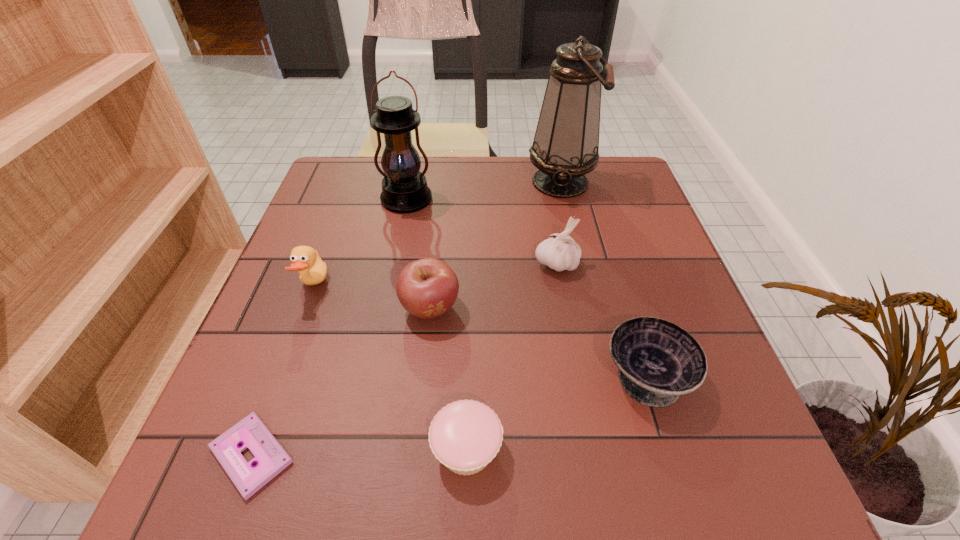
Where is `empty space that is in between the bowl and the oil lamp`? The image size is (960, 540). empty space that is in between the bowl and the oil lamp is located at coordinates (604, 279).

Locate an element on the screen. free space between the cupcake and the videotape is located at coordinates (359, 452).

What are the coordinates of `object that is the third closest one to the videotape` in the screenshot? It's located at (306, 260).

Locate an element on the screen. The image size is (960, 540). object that is the seventh closest to the bowl is located at coordinates pyautogui.click(x=306, y=260).

Identify the location of vacant region that satisfies the following two spatial constraints: 1. on the beak of the duck; 2. on the left side of the cupcake. The height and width of the screenshot is (540, 960). coord(253,449).

Where is `free space that satisfies the following two spatial constraints: 1. on the beak of the videotape; 2. on the left side of the duck`? Image resolution: width=960 pixels, height=540 pixels. free space that satisfies the following two spatial constraints: 1. on the beak of the videotape; 2. on the left side of the duck is located at coordinates (252, 455).

The width and height of the screenshot is (960, 540). Find the location of `free region that satisfies the following two spatial constraints: 1. above the lantern, indicating its light source; 2. on the right side of the bowl`. free region that satisfies the following two spatial constraints: 1. above the lantern, indicating its light source; 2. on the right side of the bowl is located at coordinates (371, 376).

Where is `blank area in the image that satisfies the following two spatial constraints: 1. on the back side of the cupcake; 2. on the right side of the oil lamp`? This screenshot has height=540, width=960. blank area in the image that satisfies the following two spatial constraints: 1. on the back side of the cupcake; 2. on the right side of the oil lamp is located at coordinates (472, 182).

Find the location of `vacant space that satisfies the following two spatial constraints: 1. on the beak of the videotape; 2. on the left side of the duck`. vacant space that satisfies the following two spatial constraints: 1. on the beak of the videotape; 2. on the left side of the duck is located at coordinates (252, 455).